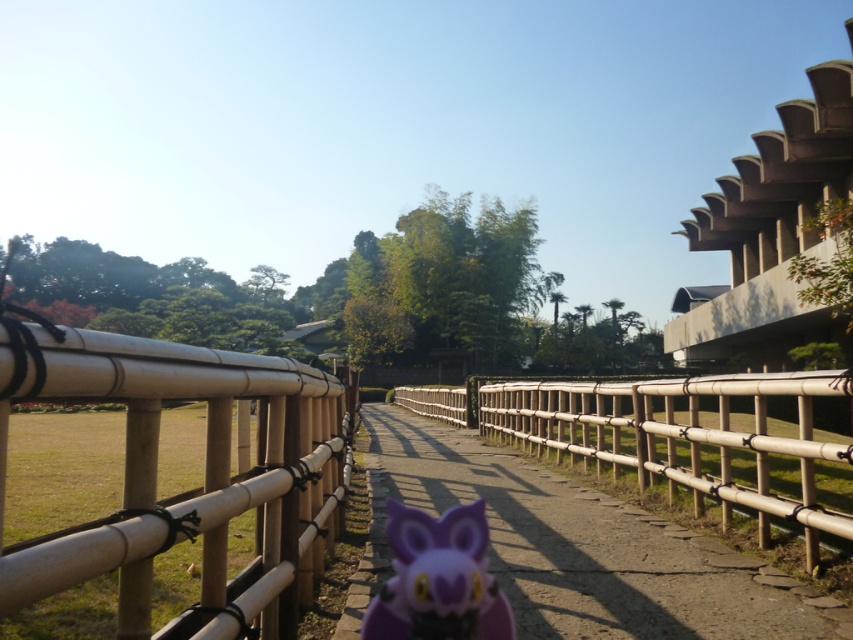
You are a gardener who wants to place a new decorative item on the pathway. The natural bamboo fence at center and the purple plastic owl at center are already present. Which object should you avoid placing a new item near if you want to ensure it doesn,t get overlooked?

You should avoid placing a new item near the purple plastic owl at center because it is larger than the natural bamboo fence at center, making it more noticeable and potentially overshadowing smaller items placed nearby.

You are standing at the entrance of the pathway in the park scene. You see the purple plastic owl at center. Can you estimate its position in terms of coordinates?

The purple plastic owl at center is located at coordinates approximately 0.858 on the x axis and 0.676 on the y axis.